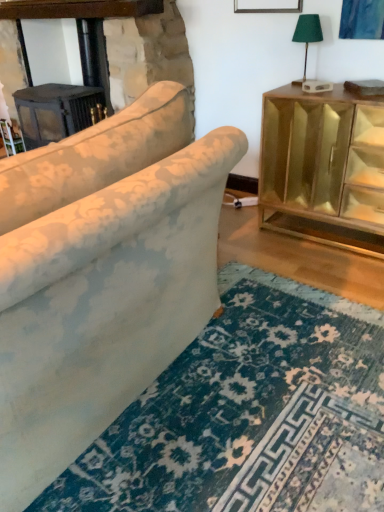
Question: From a real-world perspective, is green fabric lampshade at upper right below dark gray wood fireplace at upper left?

Choices:
 (A) yes
 (B) no

Answer: (B)

Question: Is green fabric lampshade at upper right outside dark gray wood fireplace at upper left?

Choices:
 (A) no
 (B) yes

Answer: (B)

Question: Is green fabric lampshade at upper right directly adjacent to dark gray wood fireplace at upper left?

Choices:
 (A) no
 (B) yes

Answer: (A)

Question: From the image's perspective, does green fabric lampshade at upper right appear lower than dark gray wood fireplace at upper left?

Choices:
 (A) no
 (B) yes

Answer: (B)

Question: Considering the relative sizes of green fabric lampshade at upper right and dark gray wood fireplace at upper left in the image provided, is green fabric lampshade at upper right smaller than dark gray wood fireplace at upper left?

Choices:
 (A) no
 (B) yes

Answer: (B)

Question: In terms of width, does floral fabric couch at center look wider or thinner when compared to gold mirrored cabinet at right?

Choices:
 (A) wide
 (B) thin

Answer: (A)

Question: Which is correct: floral fabric couch at center is inside gold mirrored cabinet at right, or outside of it?

Choices:
 (A) outside
 (B) inside

Answer: (A)

Question: Is floral fabric couch at center in front of or behind gold mirrored cabinet at right in the image?

Choices:
 (A) behind
 (B) front

Answer: (B)

Question: Is floral fabric couch at center taller or shorter than gold mirrored cabinet at right?

Choices:
 (A) tall
 (B) short

Answer: (A)

Question: From the image's perspective, is green fabric lampshade at upper right above or below floral fabric couch at center?

Choices:
 (A) above
 (B) below

Answer: (A)

Question: In terms of width, does green fabric lampshade at upper right look wider or thinner when compared to floral fabric couch at center?

Choices:
 (A) thin
 (B) wide

Answer: (A)

Question: Looking at the image, does green fabric lampshade at upper right seem bigger or smaller compared to floral fabric couch at center?

Choices:
 (A) small
 (B) big

Answer: (A)

Question: Considering the relative positions of green fabric lampshade at upper right and floral fabric couch at center in the image provided, is green fabric lampshade at upper right to the left or to the right of floral fabric couch at center?

Choices:
 (A) right
 (B) left

Answer: (A)

Question: Is floral fabric couch at center inside or outside of green fabric lampshade at upper right?

Choices:
 (A) outside
 (B) inside

Answer: (A)

Question: From the image's perspective, relative to green fabric lampshade at upper right, is floral fabric couch at center above or below?

Choices:
 (A) above
 (B) below

Answer: (B)